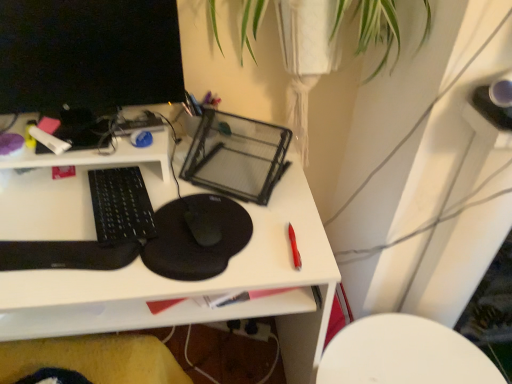
I want to click on free point behind red plastic pen at right, marked as the second stationery in a back-to-front arrangement, so click(270, 197).